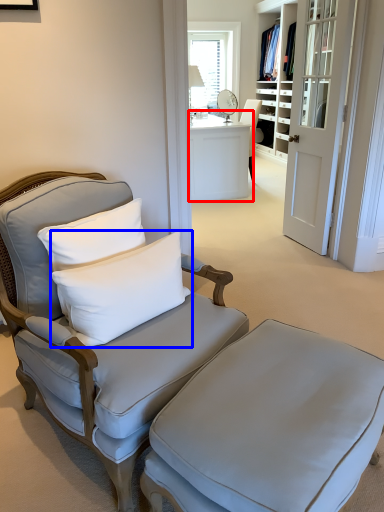
Question: Which of the following is the farthest to the observer, desk (highlighted by a red box) or pillow (highlighted by a blue box)?

Choices:
 (A) desk
 (B) pillow

Answer: (A)